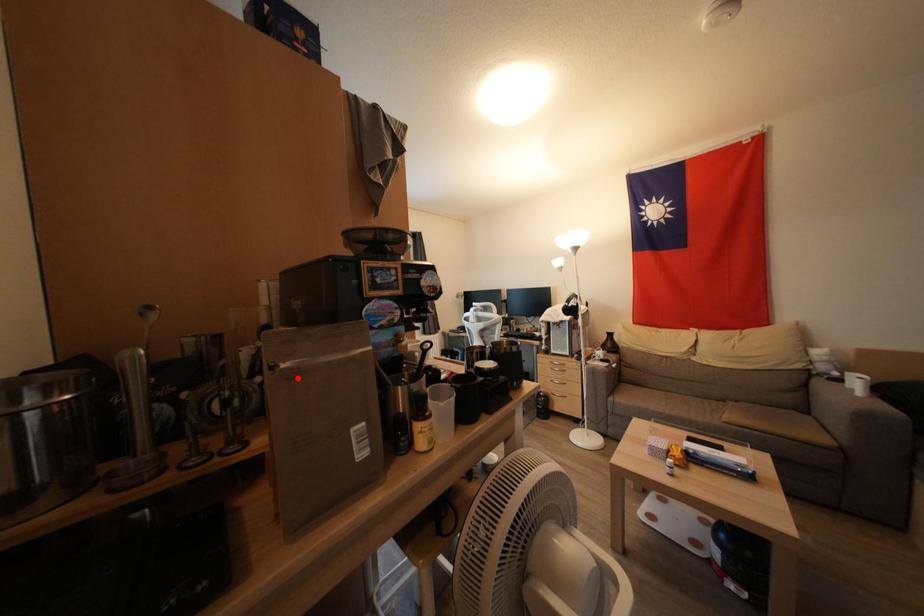
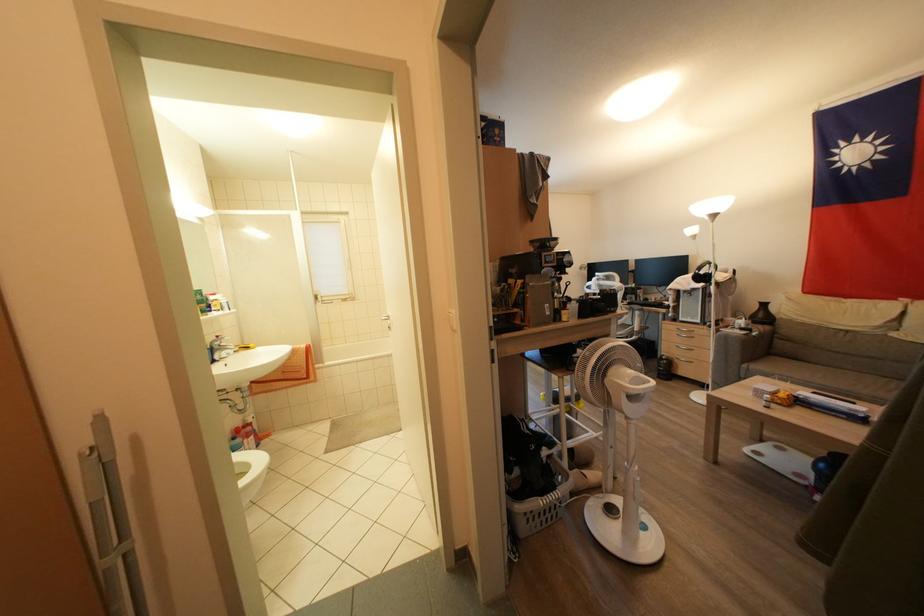
Question: I am providing you with two images of the same scene from different viewpoints. A red point is marked on the first image. At the location where the point appears in image 1, is it still visible in image 2?

Choices:
 (A) Yes
 (B) No

Answer: (A)